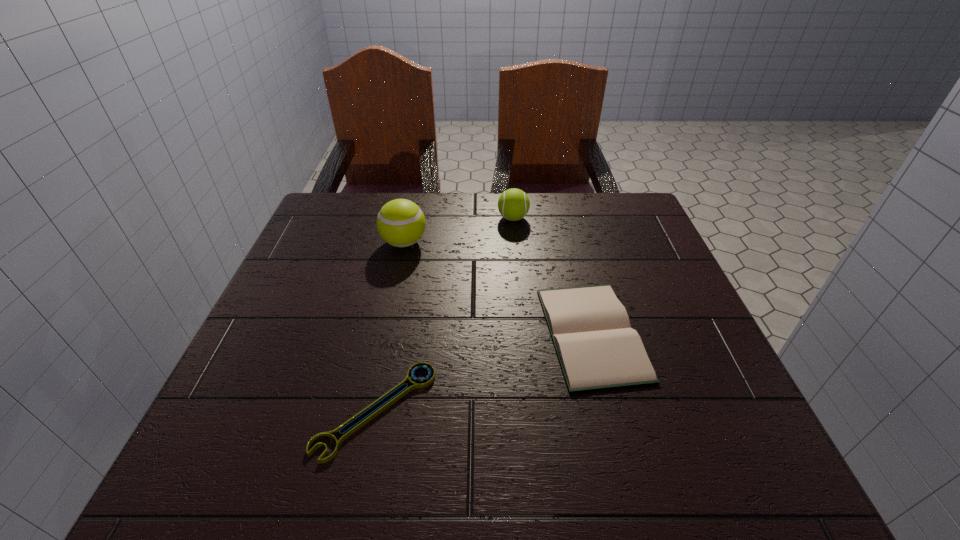
Find the location of `object located in the near edge section of the desktop`. object located in the near edge section of the desktop is located at coordinates (419, 383).

Identify the location of object that is at the right edge. (597, 348).

Find the location of `vacant space at the far edge of the desktop`. vacant space at the far edge of the desktop is located at coordinates tap(452, 218).

Image resolution: width=960 pixels, height=540 pixels. In order to click on vacant area at the near edge in this screenshot , I will do `click(620, 470)`.

The width and height of the screenshot is (960, 540). I want to click on vacant region at the left edge, so [269, 359].

Where is `free location at the right edge`? free location at the right edge is located at coordinates (657, 409).

This screenshot has width=960, height=540. What are the coordinates of `vacant space at the far left corner of the desktop` in the screenshot? It's located at (369, 192).

Identify the location of vacant region at the far right corner of the desktop. This screenshot has width=960, height=540. (640, 207).

Identify the location of empty space between the shortest object and the third nearest object. coord(390,326).

The width and height of the screenshot is (960, 540). In order to click on vacant space that is in between the left tennis ball and the shortest object in this screenshot , I will do `click(390, 326)`.